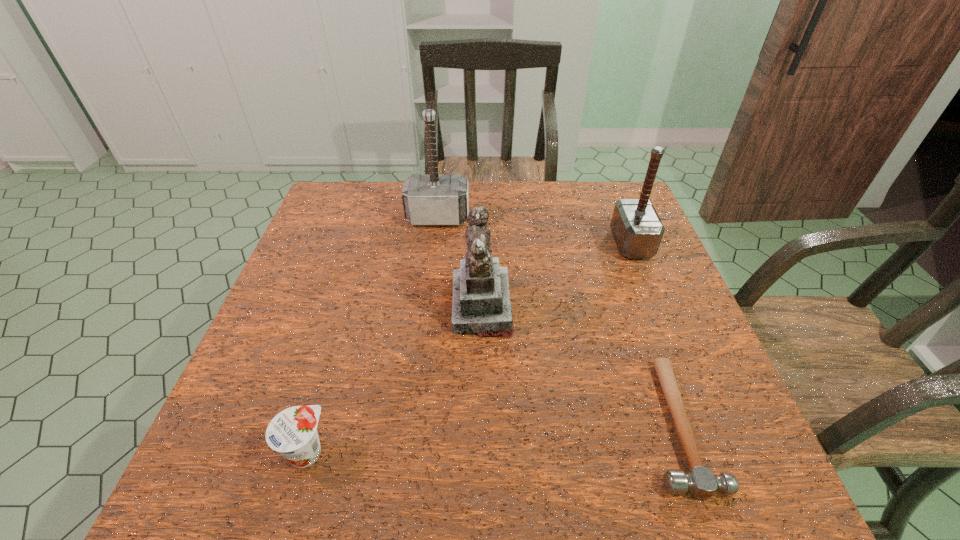
Find the location of a particular element. The height and width of the screenshot is (540, 960). hammer identified as the closest to the second shortest object is located at coordinates (700, 481).

Image resolution: width=960 pixels, height=540 pixels. Identify the location of hammer that stands as the closest to the figurine. (437, 199).